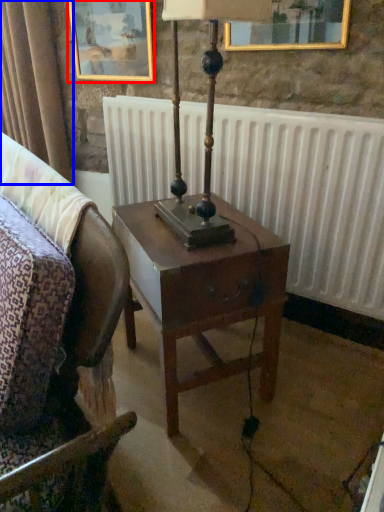
Question: Which of the following is the closest to the observer, picture frame (highlighted by a red box) or curtain (highlighted by a blue box)?

Choices:
 (A) picture frame
 (B) curtain

Answer: (A)